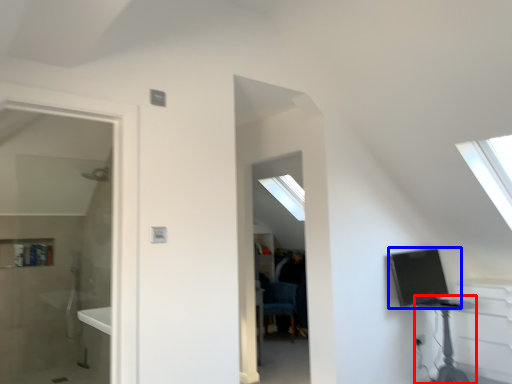
Question: Which of the following is the farthest to the observer, table (highlighted by a red box) or computer (highlighted by a blue box)?

Choices:
 (A) table
 (B) computer

Answer: (B)